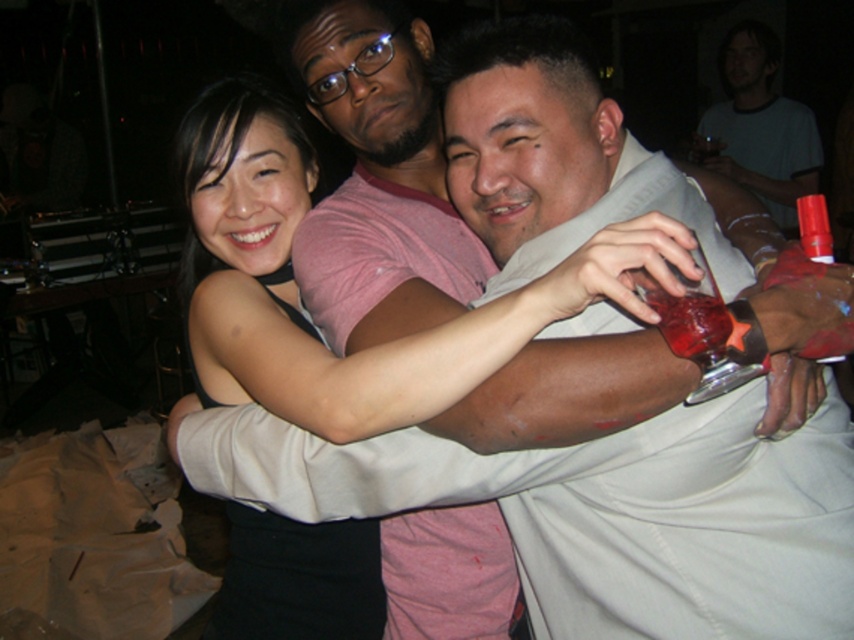
Question: Does light beige shirt at center lie in front of pink cotton shirt at center?

Choices:
 (A) no
 (B) yes

Answer: (B)

Question: Does pink cotton shirt at center appear on the right side of matte white shirt at upper right?

Choices:
 (A) yes
 (B) no

Answer: (B)

Question: Which of these objects is positioned farthest from the translucent glass at right?

Choices:
 (A) black matte dress at center
 (B) pink cotton shirt at center
 (C) matte white shirt at upper right

Answer: (C)

Question: Which object is closer to the camera taking this photo?

Choices:
 (A) light beige shirt at center
 (B) pink cotton shirt at center
 (C) translucent glass at right
 (D) matte white shirt at upper right

Answer: (C)

Question: Based on their relative distances, which object is farther from the translucent glass at right?

Choices:
 (A) light beige shirt at center
 (B) matte white shirt at upper right
 (C) pink cotton shirt at center
 (D) black matte dress at center

Answer: (B)

Question: Can you confirm if light beige shirt at center is wider than black matte dress at center?

Choices:
 (A) yes
 (B) no

Answer: (B)